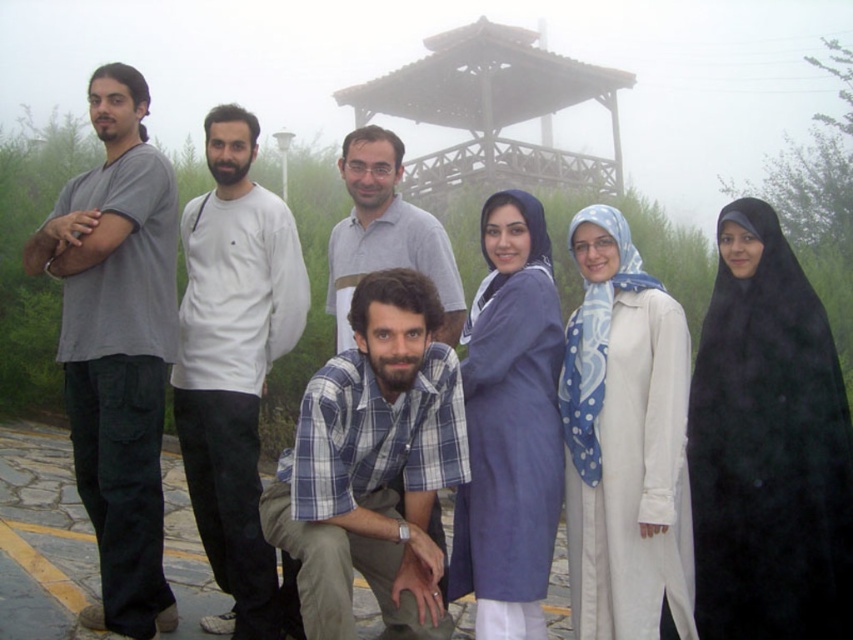
Question: Estimate the real-world distances between objects in this image. Which object is closer to the gray cotton t-shirt at left?

Choices:
 (A) black matte robe at lower right
 (B) white matte robe at center
 (C) blue cotton robe at center
 (D) matte gray shirt at center

Answer: (D)

Question: Is black matte robe at lower right smaller than gray cotton t-shirt at left?

Choices:
 (A) yes
 (B) no

Answer: (A)

Question: Is gray cotton t-shirt at left below white cotton shirt at center?

Choices:
 (A) yes
 (B) no

Answer: (B)

Question: Which point is closer to the camera taking this photo?

Choices:
 (A) (219, 216)
 (B) (421, 522)

Answer: (B)

Question: Does black matte robe at lower right have a larger size compared to white cotton shirt at center?

Choices:
 (A) no
 (B) yes

Answer: (A)

Question: Among these objects, which one is farthest from the camera?

Choices:
 (A) matte gray shirt at center
 (B) wooden gazebo at upper center

Answer: (B)